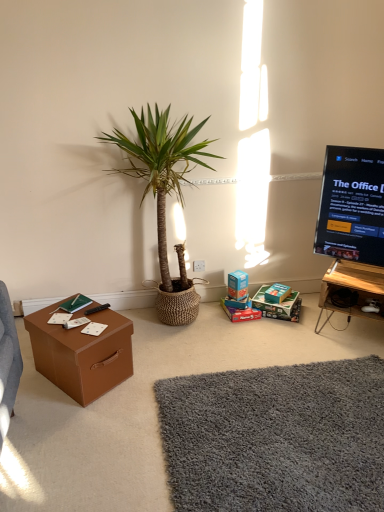
Identify the location of space that is in front of black plastic remote control at lower left. (92, 326).